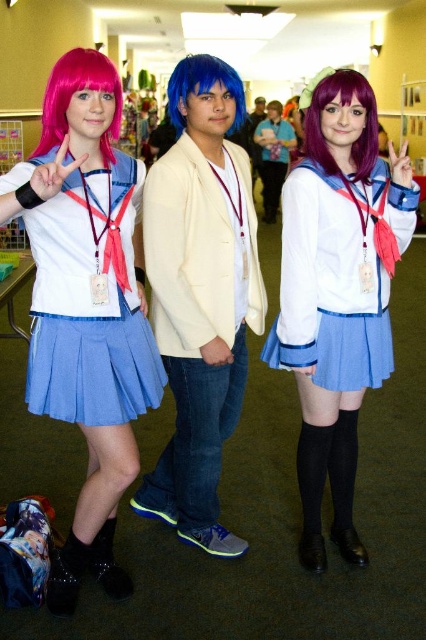
Question: Which point is farther to the camera?

Choices:
 (A) (218, 60)
 (B) (360, 275)
 (C) (100, 301)
 (D) (101, 200)

Answer: (B)

Question: Which object is positioned farthest from the pearl white plastic at center?

Choices:
 (A) satin pink wig at left
 (B) matte blue pleated skirt at left

Answer: (A)

Question: Is pink synthetic wig at upper left behind blue synthetic wig at center?

Choices:
 (A) yes
 (B) no

Answer: (B)

Question: Which point is farther from the camera taking this photo?

Choices:
 (A) (204, 456)
 (B) (275, 113)
 (C) (313, 188)

Answer: (B)

Question: In this image, where is pink synthetic wig at upper left located relative to purple silky wig at center?

Choices:
 (A) left
 (B) right

Answer: (A)

Question: Considering the relative positions of satin purple skirt at center and matte white sailor uniform at center in the image provided, where is satin purple skirt at center located with respect to matte white sailor uniform at center?

Choices:
 (A) right
 (B) left

Answer: (B)